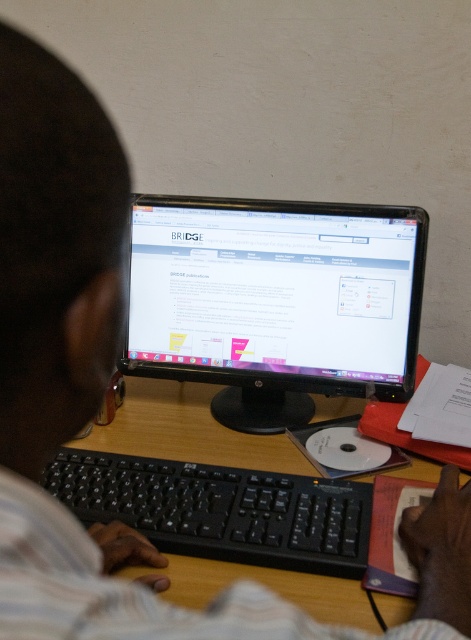
Question: Does wooden table at center appear under black plastic keyboard at lower center?

Choices:
 (A) yes
 (B) no

Answer: (B)

Question: Which object is closer to the camera taking this photo?

Choices:
 (A) black plastic keyboard at lower center
 (B) black glossy monitor at center
 (C) wooden table at center

Answer: (C)

Question: Is the position of wooden table at center more distant than that of black plastic keyboard at lower center?

Choices:
 (A) no
 (B) yes

Answer: (A)

Question: Which point appears closest to the camera in this image?

Choices:
 (A) (285, 502)
 (B) (379, 342)
 (C) (332, 600)

Answer: (C)

Question: Which of the following is the farthest from the observer?

Choices:
 (A) (409, 344)
 (B) (73, 451)
 (C) (370, 477)

Answer: (A)

Question: Does wooden table at center appear on the left side of black plastic keyboard at lower center?

Choices:
 (A) no
 (B) yes

Answer: (A)